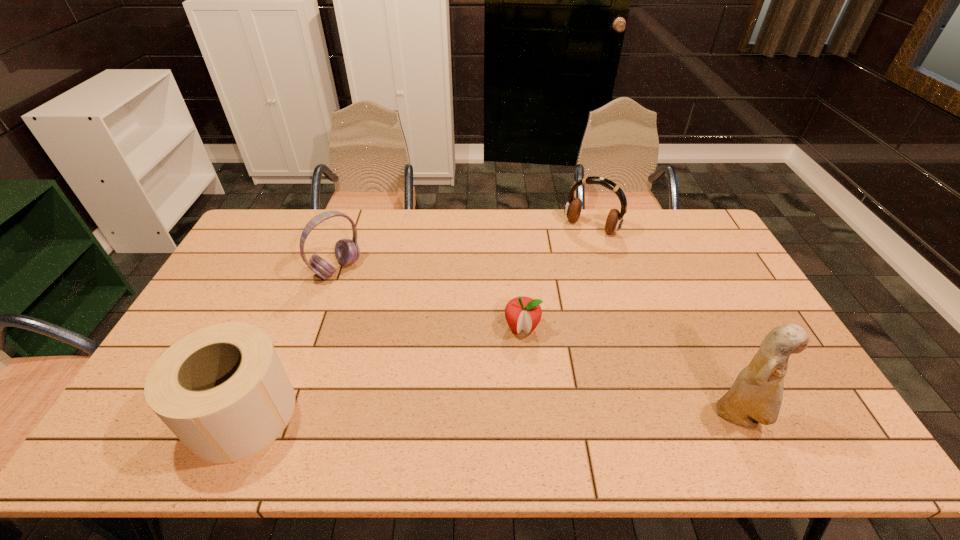
This screenshot has width=960, height=540. I want to click on toilet tissue that is at the near edge, so click(222, 390).

Locate an element on the screen. The image size is (960, 540). figurine located at the near edge is located at coordinates (755, 397).

The height and width of the screenshot is (540, 960). I want to click on object present at the left edge, so click(x=222, y=390).

This screenshot has width=960, height=540. I want to click on object positioned at the right edge, so click(755, 397).

Where is `object present at the near left corner`? object present at the near left corner is located at coordinates (222, 390).

Identify the location of object that is at the near right corner. Image resolution: width=960 pixels, height=540 pixels. (755, 397).

The image size is (960, 540). I want to click on vacant position at the far edge of the desktop, so click(483, 215).

This screenshot has height=540, width=960. I want to click on free region at the near edge, so click(x=323, y=388).

In the image, there is a desktop. Where is `vacant space at the right edge`? This screenshot has height=540, width=960. vacant space at the right edge is located at coordinates (701, 289).

Where is `vacant space at the far left corner of the desktop`? The height and width of the screenshot is (540, 960). vacant space at the far left corner of the desktop is located at coordinates (250, 236).